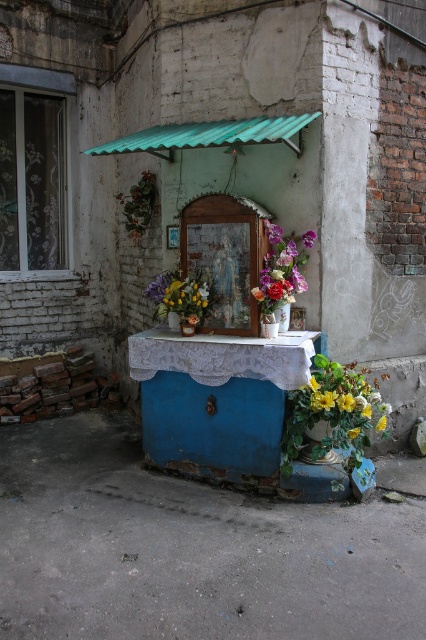
Image resolution: width=426 pixels, height=640 pixels. Find the location of `yellow artificial flowers at lower right`. yellow artificial flowers at lower right is located at coordinates (331, 413).

Is yellow artificial flowers at lower right shorter than yellow matte flower at lower right?

No.

Who is more distant from viewer, (334, 403) or (383, 417)?

Point (383, 417)

This screenshot has width=426, height=640. What are the coordinates of `yellow artificial flowers at lower right` in the screenshot? It's located at (331, 413).

Who is shorter, green corrugated metal awning at upper center or yellow matte flower at lower right?

With less height is yellow matte flower at lower right.

Does green corrugated metal awning at upper center have a lesser width compared to yellow matte flower at lower right?

No.

Image resolution: width=426 pixels, height=640 pixels. I want to click on green corrugated metal awning at upper center, so click(207, 132).

This screenshot has height=640, width=426. Identify the location of green corrugated metal awning at upper center. (207, 132).

Is the position of yellow artificial flowers at lower right less distant than that of green corrugated metal awning at upper center?

No.

Between point (302, 436) and point (103, 144), which one is positioned behind?

The point (103, 144) is behind.

The image size is (426, 640). What do you see at coordinates (331, 413) in the screenshot?
I see `yellow artificial flowers at lower right` at bounding box center [331, 413].

In order to click on yellow artificial flowers at lower right in this screenshot , I will do `click(331, 413)`.